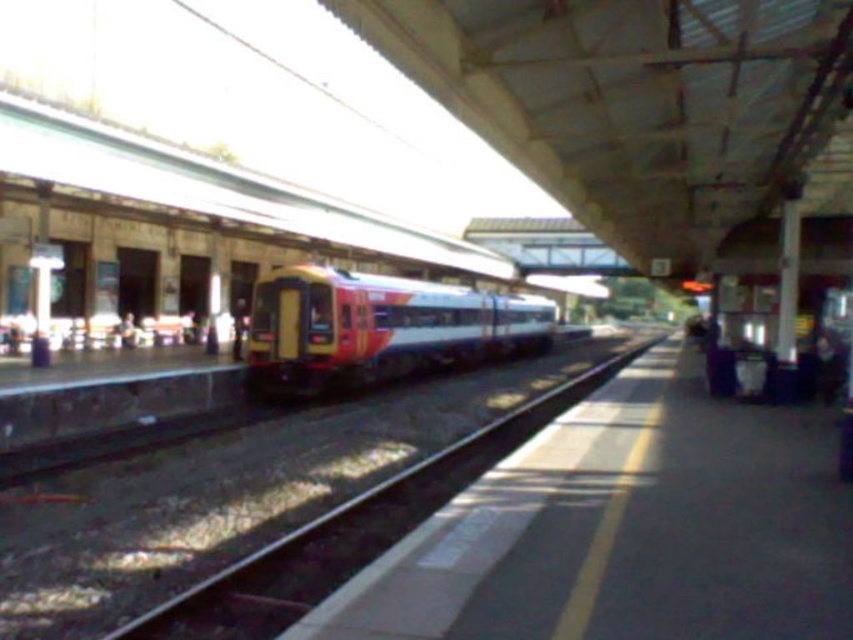
You are a parent holding a child who wants to play with a toy. You see the yellow and red plastic train at center and the smooth metal track at center. Which object is bigger and more suitable for the child to play with?

The yellow and red plastic train at center is larger in size than the smooth metal track at center, so it is more suitable for the child to play with.

You are a maintenance worker checking the dimensions of the yellow and red plastic train at center and the smooth metal track at center. According to the description, could the train potentially be too wide to fit on the track?

The yellow and red plastic train at center might be wider than smooth metal track at center, so there is a possibility that the train is too wide to fit on the track.

You are standing at the train station and see the yellow and red plastic train at center. If you were to walk directly towards it from your current position, which direction should you move relative to the platform safety line?

Since the yellow and red plastic train at center is located at coordinates point (378, 326), you should move towards the center of the platform, perpendicular to the safety line, to reach it directly.